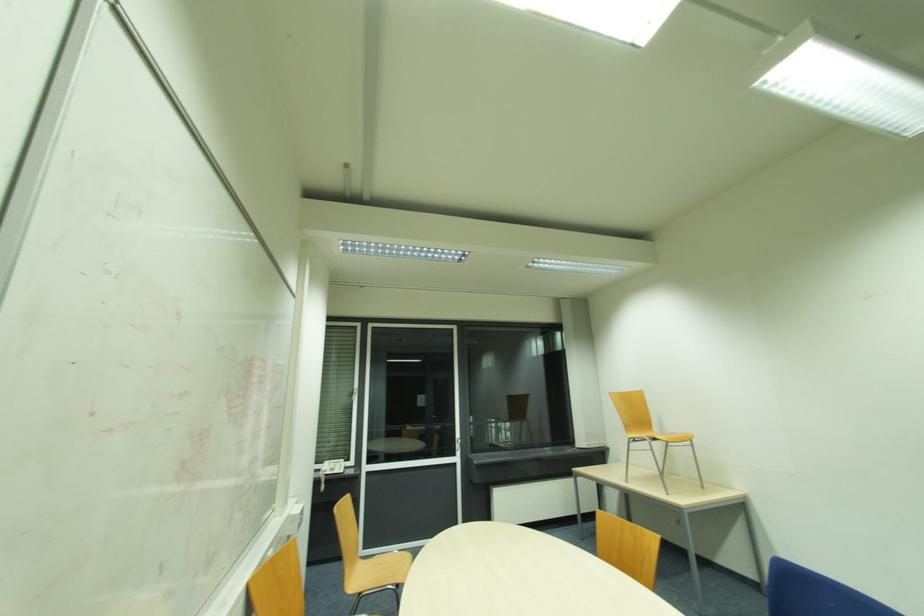
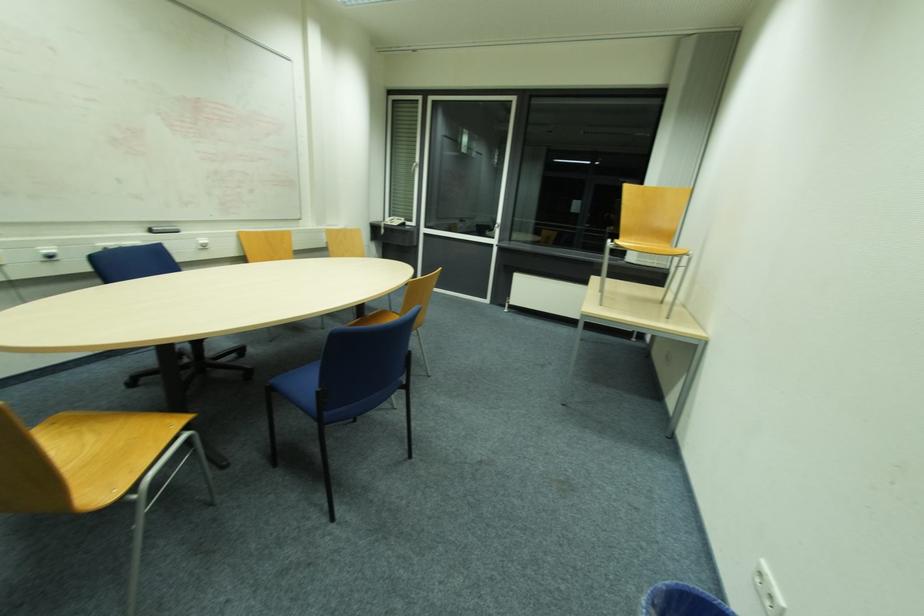
The point at (460, 440) is marked in the first image. Where is the corresponding point in the second image?

(497, 225)